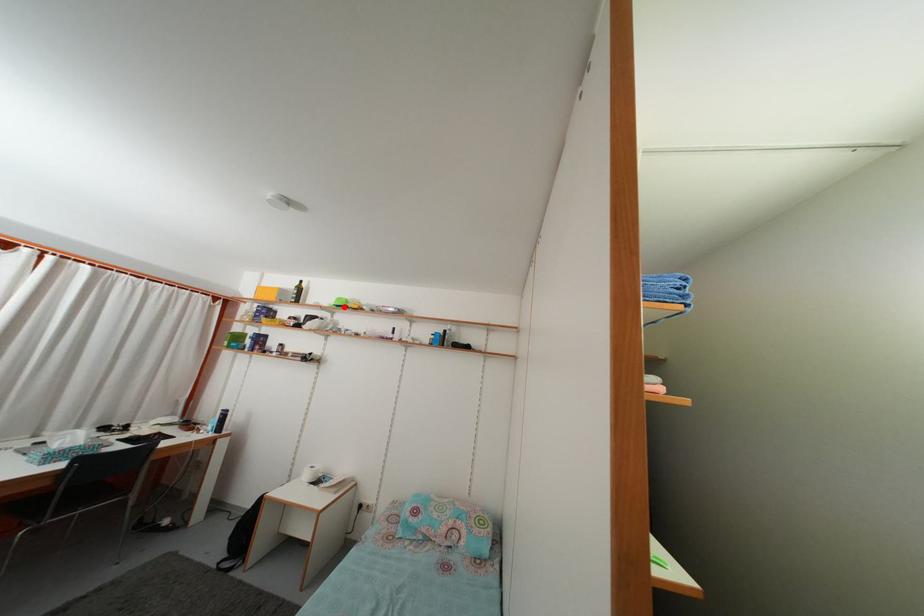
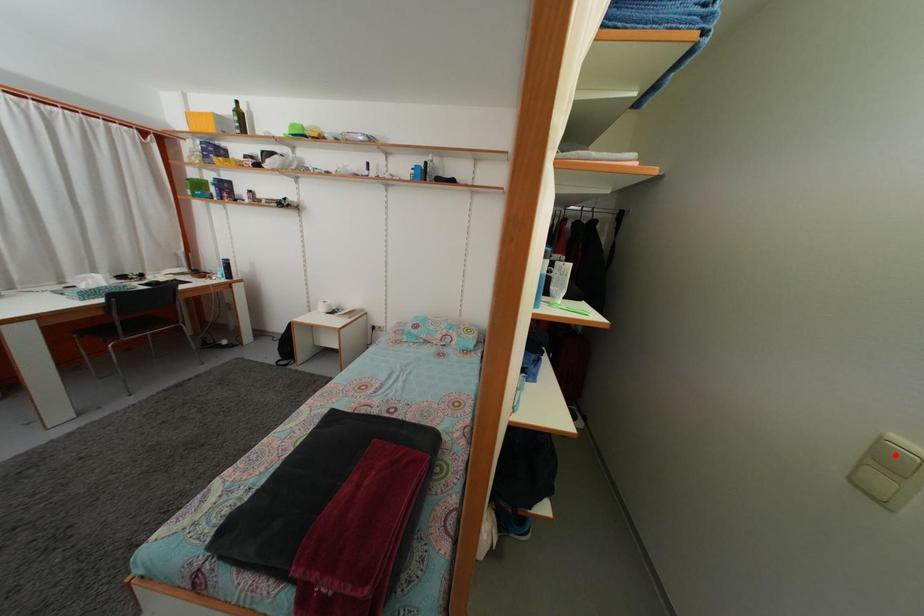
I am providing you with two images of the same scene from different viewpoints. A red point is marked on the first image and another point is marked on the second image. Does the point marked in image1 correspond to the same location as the one in image2?

No